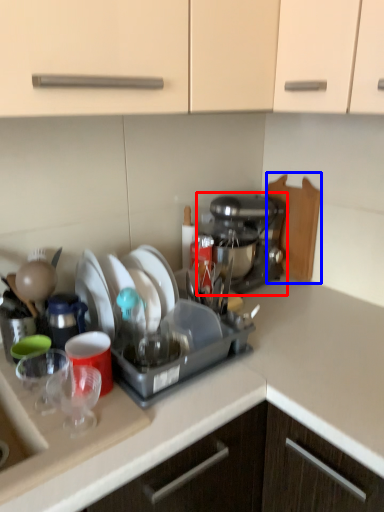
Question: Among these objects, which one is farthest to the camera, coffee maker (highlighted by a red box) or cutting board (highlighted by a blue box)?

Choices:
 (A) coffee maker
 (B) cutting board

Answer: (B)